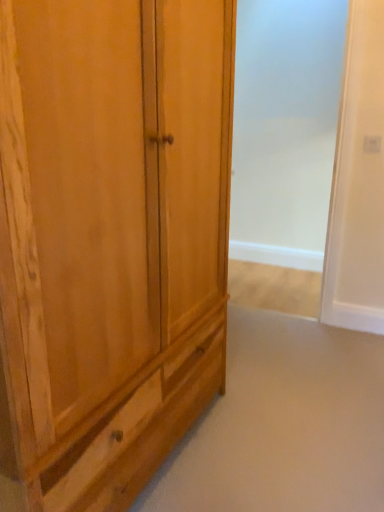
Question: Is natural wood cupboard at left taller than white glossy screen door at center?

Choices:
 (A) no
 (B) yes

Answer: (A)

Question: Is natural wood cupboard at left in front of white glossy screen door at center?

Choices:
 (A) yes
 (B) no

Answer: (A)

Question: Could you tell me if natural wood cupboard at left is facing white glossy screen door at center?

Choices:
 (A) no
 (B) yes

Answer: (A)

Question: Can you confirm if natural wood cupboard at left is positioned to the left of white glossy screen door at center?

Choices:
 (A) yes
 (B) no

Answer: (A)

Question: Is natural wood cupboard at left oriented away from white glossy screen door at center?

Choices:
 (A) no
 (B) yes

Answer: (A)

Question: Can you confirm if natural wood cupboard at left is bigger than white glossy screen door at center?

Choices:
 (A) no
 (B) yes

Answer: (B)

Question: Can you confirm if white glossy screen door at center is taller than natural wood cupboard at left?

Choices:
 (A) yes
 (B) no

Answer: (A)

Question: Is white glossy screen door at center to the right of natural wood cupboard at left from the viewer's perspective?

Choices:
 (A) yes
 (B) no

Answer: (A)

Question: Can you confirm if white glossy screen door at center is wider than natural wood cupboard at left?

Choices:
 (A) yes
 (B) no

Answer: (B)

Question: Is the position of white glossy screen door at center less distant than that of natural wood cupboard at left?

Choices:
 (A) yes
 (B) no

Answer: (B)

Question: Is white glossy screen door at center positioned with its back to natural wood cupboard at left?

Choices:
 (A) yes
 (B) no

Answer: (B)

Question: Can you confirm if white glossy screen door at center is smaller than natural wood cupboard at left?

Choices:
 (A) no
 (B) yes

Answer: (B)

Question: Considering the positions of natural wood cupboard at left and white glossy screen door at center in the image, is natural wood cupboard at left bigger or smaller than white glossy screen door at center?

Choices:
 (A) big
 (B) small

Answer: (A)